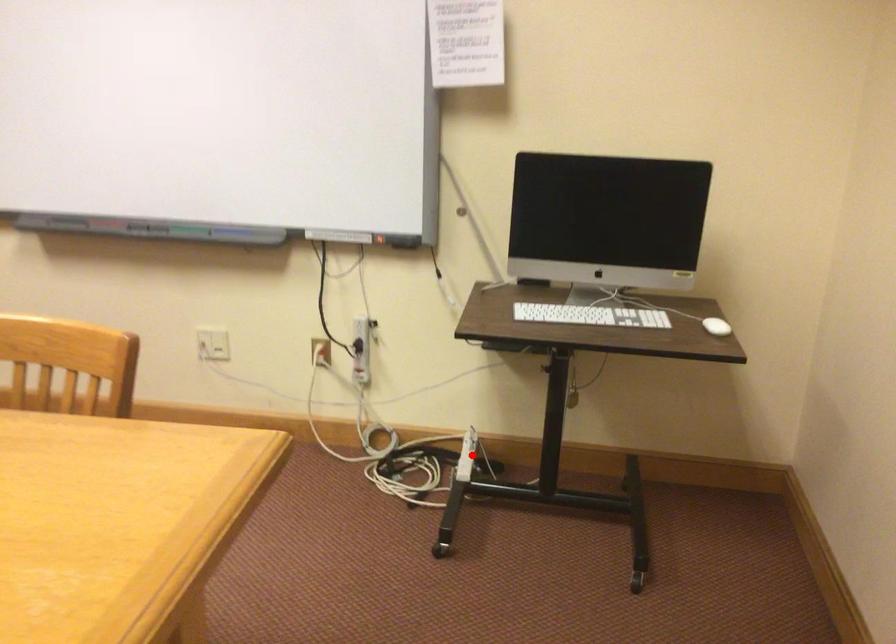
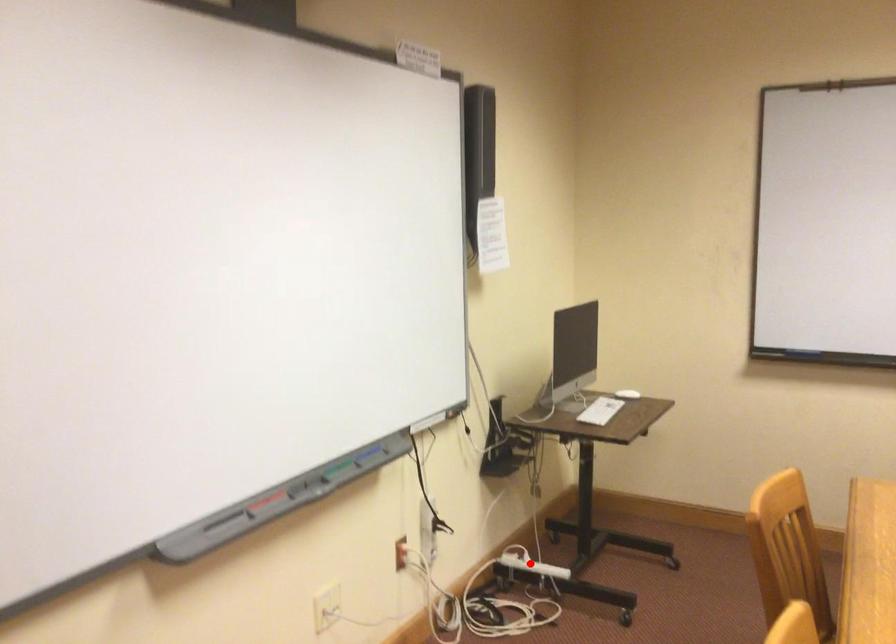
Based on the photo, I am providing you with two images of the same scene from different viewpoints. A red point is marked on the first image and another point is marked on the second image. Is the marked point in image1 the same physical position as the marked point in image2?

Yes